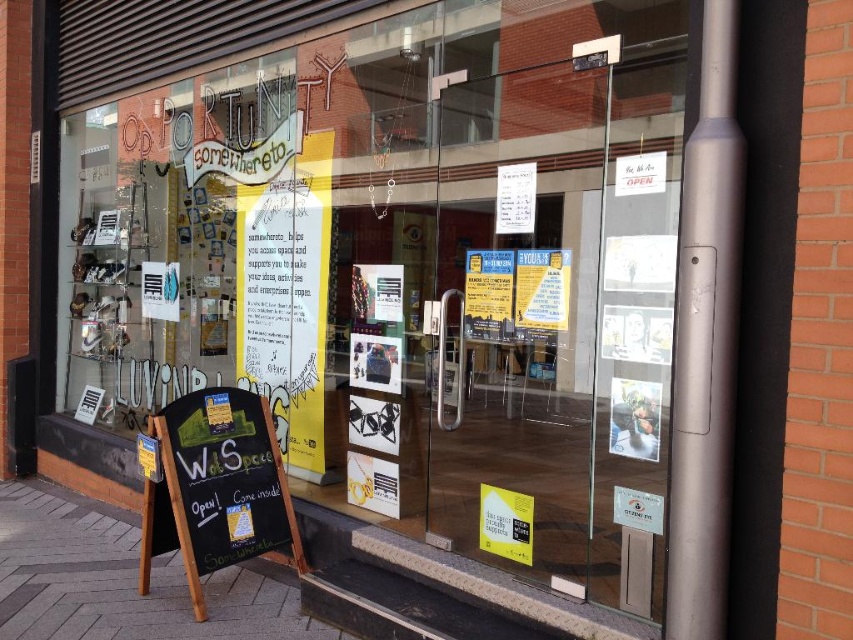
You are a delivery person trying to see the store name. You can only look through the transparent glass shop window at center and the black chalkboard at lower left. Which object will allow you to see the store name more clearly?

The black chalkboard at lower left displays the store name, so you can see the store name more clearly through the black chalkboard at lower left.